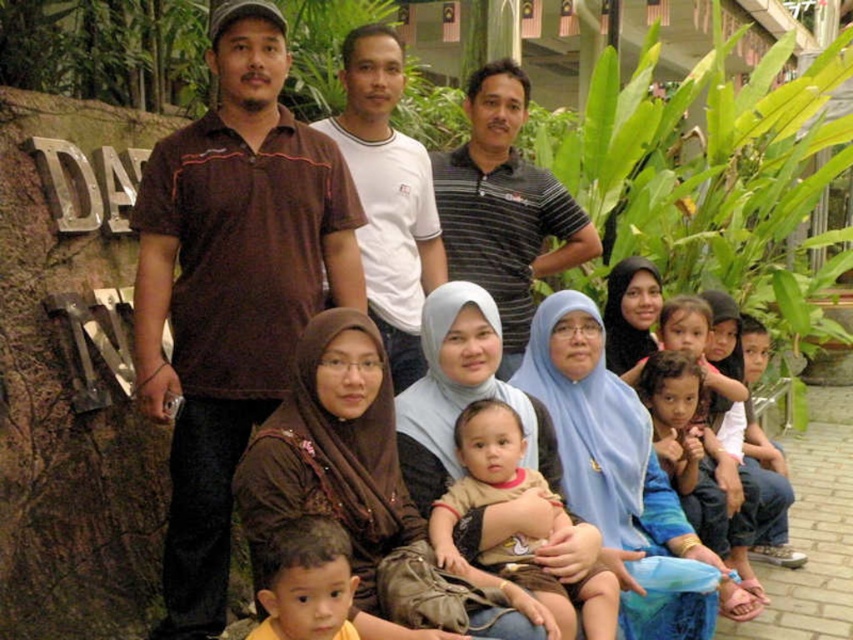
Can you confirm if brown cotton shirt at center is positioned above brown hair at center?

Yes, brown cotton shirt at center is above brown hair at center.

Does brown cotton shirt at center appear on the right side of brown hair at center?

Yes, brown cotton shirt at center is to the right of brown hair at center.

The image size is (853, 640). What are the coordinates of `brown cotton shirt at center` in the screenshot? It's located at (517, 532).

Is point (201, 554) closer to camera compared to point (508, 221)?

Yes, point (201, 554) is in front of point (508, 221).

Where is `brown cotton shirt at left`? brown cotton shirt at left is located at coordinates (231, 289).

Can you confirm if striped polo shirt at upper center is wider than brown cotton shirt at center?

Indeed, striped polo shirt at upper center has a greater width compared to brown cotton shirt at center.

Does striped polo shirt at upper center have a smaller size compared to brown cotton shirt at center?

Incorrect, striped polo shirt at upper center is not smaller in size than brown cotton shirt at center.

Find the location of a particular element. striped polo shirt at upper center is located at coordinates (503, 205).